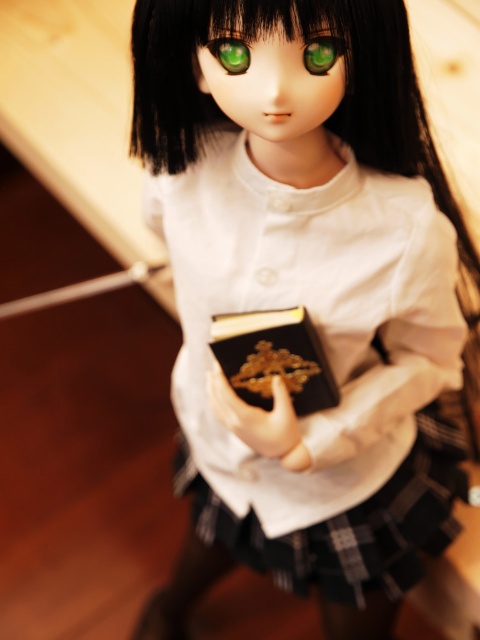
You are an appraiser examining the doll and need to determine the spatial arrangement of its accessories. Which object is positioned to the right of the other between the smooth gold ring at center and the green glossy eye at upper center?

The smooth gold ring at center is to the right of the green glossy eye at upper center, so the smooth gold ring at center is positioned to the right of the green glossy eye at upper center.

You are organizing a display and want to place both the black leather book at center and the smooth gold ring at center on a shelf. Since the shelf has limited vertical space, which object will require more vertical space due to its height?

The black leather book at center requires more vertical space because it has a greater height compared to the smooth gold ring at center.